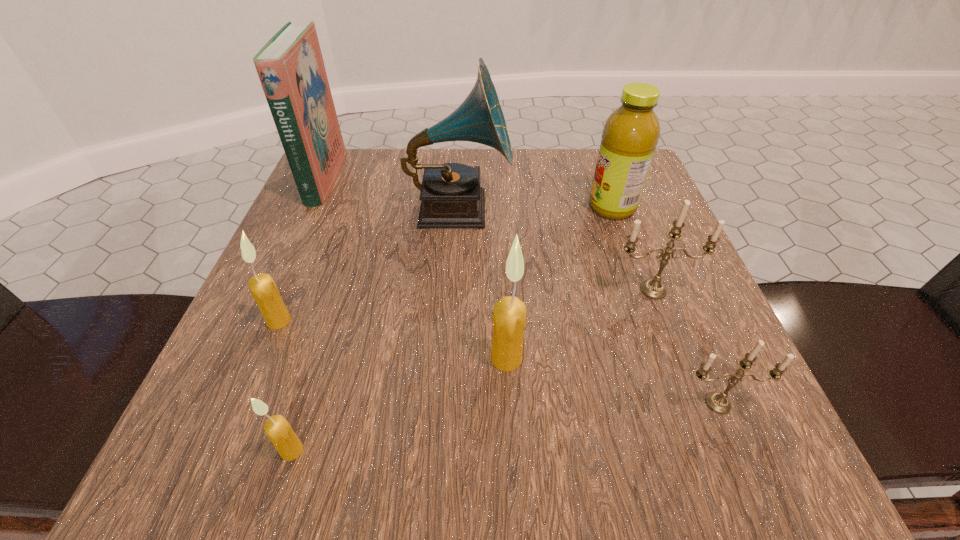
Find the location of a particular element. Image resolution: width=960 pixels, height=540 pixels. the smallest cream candle is located at coordinates (278, 430).

What are the coordinates of `the smaller metallic candle` in the screenshot? It's located at coord(718,402).

At what (x,y) coordinates should I click in order to perform the action: click on the seventh farthest object. Please return your answer as a coordinate pair (x, y). The height and width of the screenshot is (540, 960). Looking at the image, I should click on (718, 402).

Where is `free space located on the cover of the hardback book`? The height and width of the screenshot is (540, 960). free space located on the cover of the hardback book is located at coordinates (446, 179).

The image size is (960, 540). I want to click on vacant area located from the horn of the phonograph_record, so click(x=609, y=209).

The width and height of the screenshot is (960, 540). I want to click on blank area located on the front label of the fruit juice, so click(x=524, y=207).

Locate an element on the screen. vacant area located on the front label of the fruit juice is located at coordinates (534, 207).

Locate an element on the screen. vacant space located 0.210m on the front label of the fruit juice is located at coordinates (485, 207).

Where is `vacant space situated 0.100m on the left of the second nearest cream candle`? Image resolution: width=960 pixels, height=540 pixels. vacant space situated 0.100m on the left of the second nearest cream candle is located at coordinates (422, 359).

The width and height of the screenshot is (960, 540). Identify the location of blank space located on the right of the fifth farthest object. (342, 321).